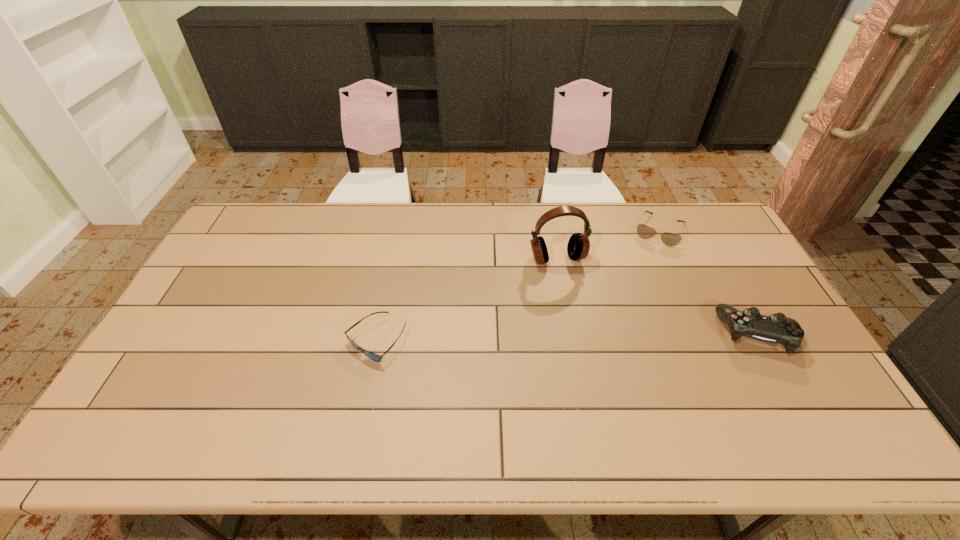
Where is `vacant region between the control and the tallest object`? vacant region between the control and the tallest object is located at coordinates (657, 296).

Image resolution: width=960 pixels, height=540 pixels. What are the coordinates of `vacant area that lies between the shortest object and the headset` in the screenshot? It's located at (467, 300).

I want to click on empty space between the second tallest object and the second farthest object, so click(657, 296).

Identify the location of free space between the shortest object and the control. (566, 337).

Locate an element on the screen. Image resolution: width=960 pixels, height=540 pixels. vacant area that lies between the nearer sunglasses and the control is located at coordinates (566, 337).

At what (x,y) coordinates should I click in order to perform the action: click on the closest object relative to the control. Please return your answer as a coordinate pair (x, y). Looking at the image, I should click on (670, 239).

Identify which object is the closest to the second tallest object. Please provide its 2D coordinates. Your answer should be formatted as a tuple, i.e. [(x, y)], where the tuple contains the x and y coordinates of a point satisfying the conditions above.

[(670, 239)]

The width and height of the screenshot is (960, 540). What are the coordinates of `vacant region that satisfies the following two spatial constraints: 1. on the back side of the farthest object; 2. on the left side of the third nearest object` in the screenshot? It's located at (552, 230).

This screenshot has height=540, width=960. I want to click on vacant space that satisfies the following two spatial constraints: 1. on the back side of the third nearest object; 2. on the right side of the taller sunglasses, so click(x=552, y=230).